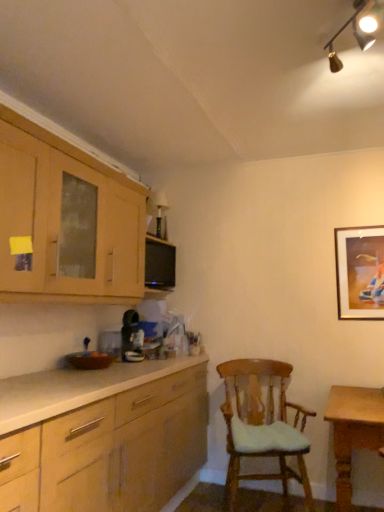
What is the approximate width of gold-framed picture at upper right?

It is 6.12 centimeters.

You are a GUI agent. You are given a task and a screenshot of the screen. Output one action in this format:
    pyautogui.click(x=<x>, y=<y>)
    Task: Click on the wooden cabinet at upper left
    Image resolution: width=384 pixels, height=512 pixels.
    Given the screenshot: What is the action you would take?
    pyautogui.click(x=60, y=219)

From the image's perspective, is gold metallic track lighting at upper right below wooden cabinet at upper left?

No, from the image's perspective, gold metallic track lighting at upper right is not beneath wooden cabinet at upper left.

Is gold metallic track lighting at upper right bigger than wooden cabinet at upper left?

Actually, gold metallic track lighting at upper right might be smaller than wooden cabinet at upper left.

Where is `light fixture that appears above the wooden cabinet at upper left (from the image's perspective)`? This screenshot has width=384, height=512. light fixture that appears above the wooden cabinet at upper left (from the image's perspective) is located at coordinates (355, 37).

From the image's perspective, which one is positioned higher, gold-framed picture at upper right or gold metallic track lighting at upper right?

gold metallic track lighting at upper right, from the image's perspective.

From a real-world perspective, is gold-framed picture at upper right positioned under gold metallic track lighting at upper right based on gravity?

Yes.

Between gold-framed picture at upper right and gold metallic track lighting at upper right, which one has larger size?

gold metallic track lighting at upper right is bigger.

Which object is further away from the camera taking this photo, gold-framed picture at upper right or gold metallic track lighting at upper right?

gold-framed picture at upper right.

Does point (309, 494) come closer to viewer compared to point (33, 209)?

No, it is not.

Identify the location of cabinetry above the wooden chair with cushion at center (from the image's perspective). (60, 219).

From the image's perspective, does wooden chair with cushion at center appear lower than wooden cabinet at upper left?

Indeed, from the image's perspective, wooden chair with cushion at center is shown beneath wooden cabinet at upper left.

Considering the relative sizes of wooden chair with cushion at center and wooden cabinet at upper left in the image provided, is wooden chair with cushion at center thinner than wooden cabinet at upper left?

In fact, wooden chair with cushion at center might be wider than wooden cabinet at upper left.

From the image's perspective, which one is positioned lower, wooden chair with cushion at center or gold metallic track lighting at upper right?

wooden chair with cushion at center appears lower in the image.

Which is behind, point (254, 368) or point (333, 66)?

The point (254, 368) is farther from the camera.

Is gold metallic track lighting at upper right at the back of wooden chair with cushion at center?

No, wooden chair with cushion at center is not facing away from gold metallic track lighting at upper right.

Looking at this image, can you confirm if wooden chair with cushion at center is taller than gold metallic track lighting at upper right?

Indeed, wooden chair with cushion at center has a greater height compared to gold metallic track lighting at upper right.

Find the location of `cabinetry in front of the wooden table at lower right`. cabinetry in front of the wooden table at lower right is located at coordinates (60, 219).

From a real-world perspective, who is located lower, wooden cabinet at upper left or wooden table at lower right?

wooden table at lower right.

Does wooden cabinet at upper left have a lesser height compared to wooden table at lower right?

No.

Considering the relative positions of wooden cabinet at upper left and wooden table at lower right in the image provided, is wooden cabinet at upper left to the left or to the right of wooden table at lower right?

wooden cabinet at upper left is to the left of wooden table at lower right.

Is wooden cabinet at upper left outside of wooden chair with cushion at center?

wooden cabinet at upper left lies outside wooden chair with cushion at center's area.

From a real-world perspective, is wooden cabinet at upper left located beneath wooden chair with cushion at center?

No, from a real-world perspective, wooden cabinet at upper left is not under wooden chair with cushion at center.

Can you confirm if wooden cabinet at upper left is smaller than wooden chair with cushion at center?

Incorrect, wooden cabinet at upper left is not smaller in size than wooden chair with cushion at center.

From the image's perspective, relative to gold-framed picture at upper right, is gold metallic track lighting at upper right above or below?

gold metallic track lighting at upper right is situated higher than gold-framed picture at upper right in the image.

From a real-world perspective, which object stands above the other?

gold metallic track lighting at upper right is physically above.

Measure the distance from gold metallic track lighting at upper right to gold-framed picture at upper right.

gold metallic track lighting at upper right is 4.69 feet away from gold-framed picture at upper right.

Can you tell me how much gold metallic track lighting at upper right and gold-framed picture at upper right differ in facing direction?

The angular difference between gold metallic track lighting at upper right and gold-framed picture at upper right is 0.0936 degrees.

This screenshot has width=384, height=512. I want to click on cabinetry behind the gold metallic track lighting at upper right, so click(60, 219).

Where is `picture frame that is on the right side of gold metallic track lighting at upper right`? picture frame that is on the right side of gold metallic track lighting at upper right is located at coordinates [360, 273].

Looking at the image, which one is located closer to gold-framed picture at upper right, wooden table at lower right or wooden cabinet at upper left?

The object closer to gold-framed picture at upper right is wooden table at lower right.

When comparing their distances from wooden cabinet at upper left, does wooden chair with cushion at center or gold metallic track lighting at upper right seem closer?

The object closer to wooden cabinet at upper left is wooden chair with cushion at center.

Looking at the image, which one is located closer to gold metallic track lighting at upper right, gold-framed picture at upper right or wooden table at lower right?

The object closer to gold metallic track lighting at upper right is gold-framed picture at upper right.

Consider the image. Estimate the real-world distances between objects in this image. Which object is further from wooden table at lower right, gold-framed picture at upper right or wooden chair with cushion at center?

Among the two, gold-framed picture at upper right is located further to wooden table at lower right.

From the image, which object appears to be farther from wooden table at lower right, gold-framed picture at upper right or gold metallic track lighting at upper right?

gold metallic track lighting at upper right is positioned further to the anchor wooden table at lower right.

Which object lies nearer to the anchor point wooden chair with cushion at center, gold-framed picture at upper right or wooden table at lower right?

Among the two, wooden table at lower right is located nearer to wooden chair with cushion at center.

Estimate the real-world distances between objects in this image. Which object is further from gold metallic track lighting at upper right, wooden cabinet at upper left or wooden chair with cushion at center?

Based on the image, wooden chair with cushion at center appears to be further to gold metallic track lighting at upper right.

Looking at this image, considering their positions, is wooden table at lower right positioned further to wooden cabinet at upper left than wooden chair with cushion at center?

wooden table at lower right.

Find the location of a particular element. This screenshot has width=384, height=512. chair that lies between gold metallic track lighting at upper right and wooden table at lower right from top to bottom is located at coordinates (262, 426).

The height and width of the screenshot is (512, 384). Find the location of `picture frame between gold metallic track lighting at upper right and wooden table at lower right vertically`. picture frame between gold metallic track lighting at upper right and wooden table at lower right vertically is located at coordinates (360, 273).

Image resolution: width=384 pixels, height=512 pixels. Find the location of `light fixture located between wooden cabinet at upper left and gold-framed picture at upper right in the left-right direction`. light fixture located between wooden cabinet at upper left and gold-framed picture at upper right in the left-right direction is located at coordinates (355, 37).

Where is `cabinetry between gold metallic track lighting at upper right and wooden chair with cushion at center from top to bottom`? This screenshot has height=512, width=384. cabinetry between gold metallic track lighting at upper right and wooden chair with cushion at center from top to bottom is located at coordinates (60, 219).